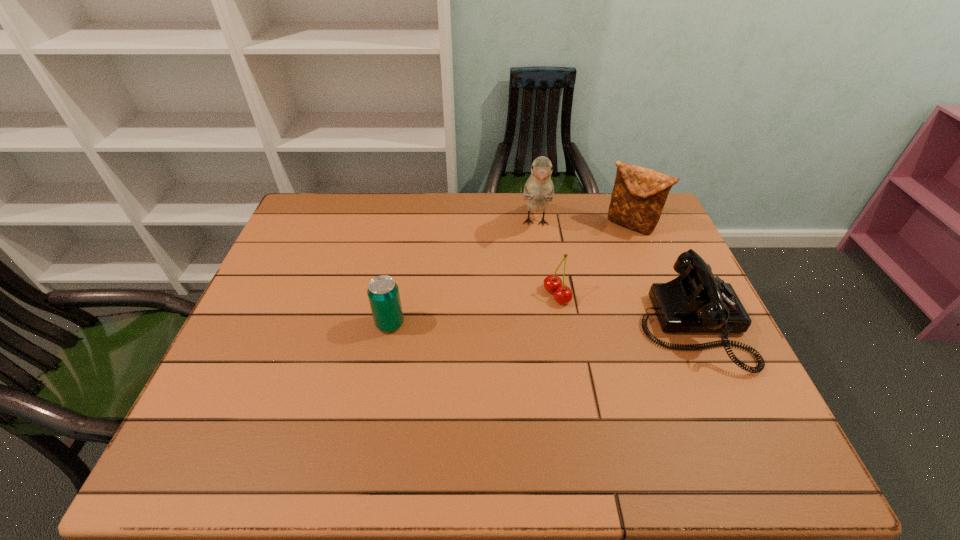
Where is `free region at the far edge of the desktop`? This screenshot has width=960, height=540. free region at the far edge of the desktop is located at coordinates (456, 201).

You are a GUI agent. You are given a task and a screenshot of the screen. Output one action in this format:
    pyautogui.click(x=<x>, y=<y>)
    Task: Click on the vacant area at the near edge
    
    Given the screenshot: What is the action you would take?
    pyautogui.click(x=297, y=418)

The width and height of the screenshot is (960, 540). Find the location of `free space at the left edge of the desktop`. free space at the left edge of the desktop is located at coordinates (303, 241).

You are a GUI agent. You are given a task and a screenshot of the screen. Output one action in this format:
    pyautogui.click(x=<x>, y=<y>)
    Task: Click on the vacant space at the right edge
    This screenshot has height=540, width=960.
    Given the screenshot: What is the action you would take?
    pyautogui.click(x=730, y=359)

You are a GUI agent. You are given a task and a screenshot of the screen. Output one action in this format:
    pyautogui.click(x=<x>, y=<y>)
    Task: Click on the vacant space at the far left corner of the desktop
    The image size is (960, 540).
    Given the screenshot: What is the action you would take?
    pyautogui.click(x=308, y=204)

Find the location of a particular element. This screenshot has height=540, width=960. blank region between the cherry and the beer can is located at coordinates (473, 309).

The width and height of the screenshot is (960, 540). Identify the location of free area in between the leftmost object and the second tallest object. tap(510, 274).

The width and height of the screenshot is (960, 540). Find the location of `vacant area between the cherry and the telephone`. vacant area between the cherry and the telephone is located at coordinates (624, 310).

Locate an element on the screen. Image resolution: width=960 pixels, height=540 pixels. unoccupied area between the leftmost object and the clutch bag is located at coordinates (510, 274).

Identify the location of vacant point located between the telephone and the cherry. (624, 310).